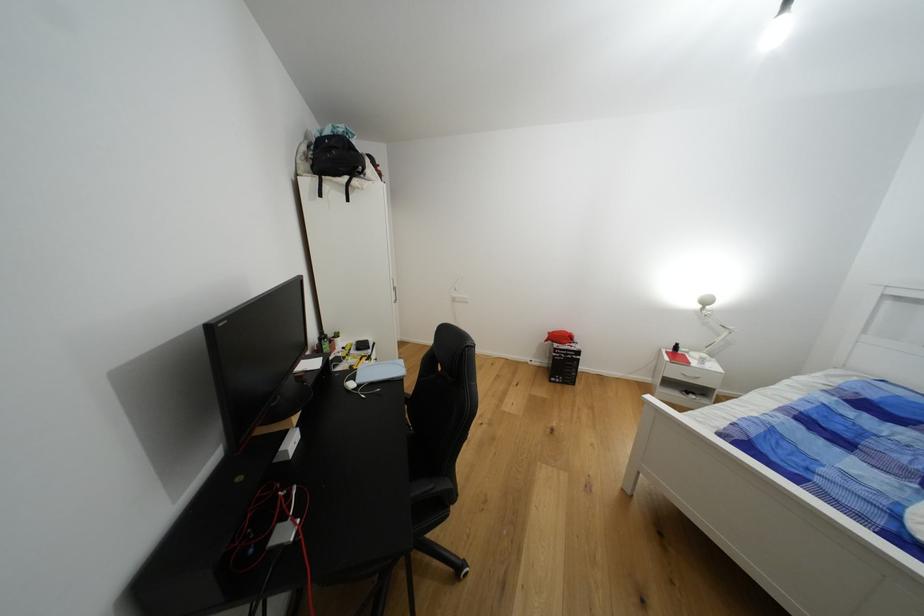
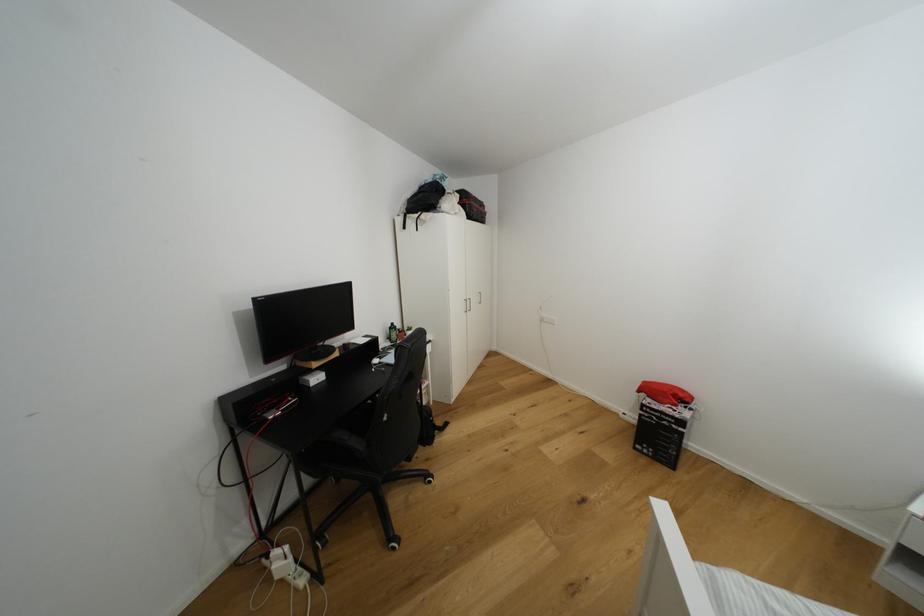
Find the pixel in the second image that matches pixel 297 445 in the first image.

(322, 379)